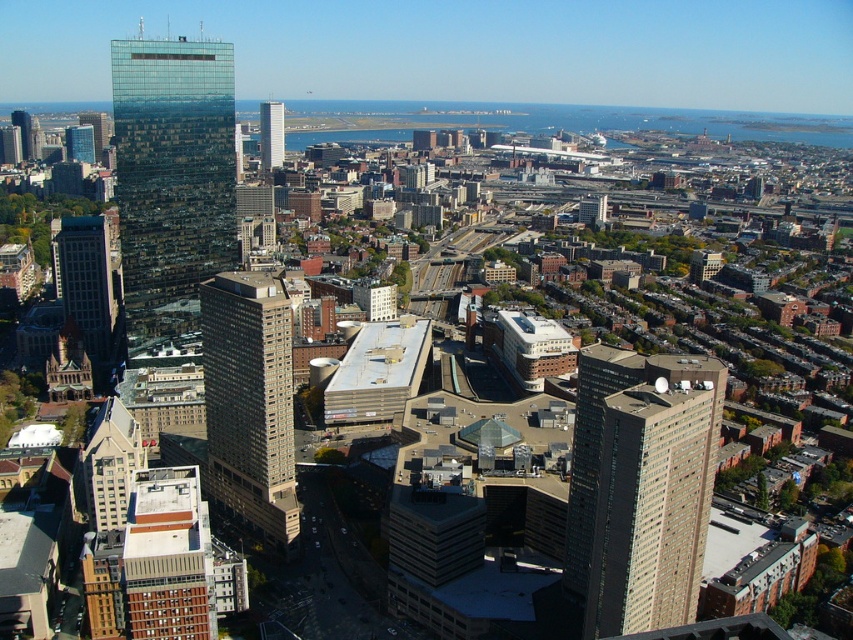
Does beige glass building at right come in front of transparent glass skyscraper at left?

That is True.

Can you confirm if beige glass building at right is positioned to the right of transparent glass skyscraper at left?

Yes, beige glass building at right is to the right of transparent glass skyscraper at left.

The width and height of the screenshot is (853, 640). What do you see at coordinates (640, 486) in the screenshot? I see `beige glass building at right` at bounding box center [640, 486].

You are a GUI agent. You are given a task and a screenshot of the screen. Output one action in this format:
    pyautogui.click(x=<x>, y=<y>)
    Task: Click on the beige glass building at right
    
    Given the screenshot: What is the action you would take?
    pyautogui.click(x=640, y=486)

Who is lower down, beige glass building at right or matte glass skyscraper at left?

beige glass building at right

Looking at this image, does beige glass building at right have a larger size compared to matte glass skyscraper at left?

Actually, beige glass building at right might be smaller than matte glass skyscraper at left.

Does point (624, 429) come behind point (59, 244)?

No, it is not.

Where is `beige glass building at right`? beige glass building at right is located at coordinates (640, 486).

Between point (231, 298) and point (277, 131), which one is positioned behind?

Positioned behind is point (277, 131).

Is beige concrete building at center below glassy reflective skyscraper at center?

Yes, beige concrete building at center is below glassy reflective skyscraper at center.

Image resolution: width=853 pixels, height=640 pixels. What do you see at coordinates (248, 401) in the screenshot?
I see `beige concrete building at center` at bounding box center [248, 401].

Find the location of `beige concrete building at center`. beige concrete building at center is located at coordinates (248, 401).